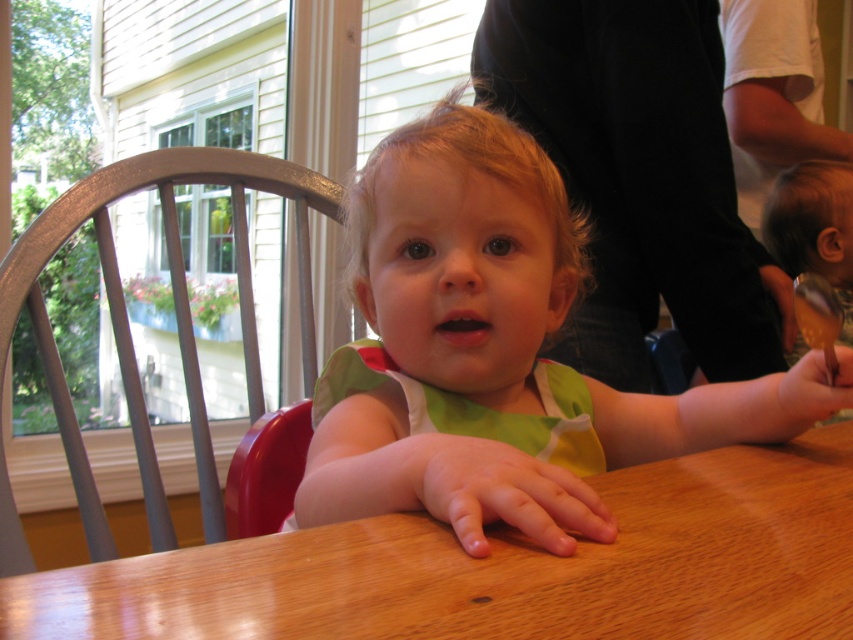
You are a parent trying to decide whether to place a spoon in the child reach area. The green cotton bib at center is on the table. Where should you place the smooth wooden spoon at lower right so it is within the child reach but not too close to the bib?

The smooth wooden spoon at lower right should be placed further away from the green cotton bib at center since the bib is closer to the viewer. Position the spoon slightly behind the bib but still within the child reach area to ensure safety and accessibility.

You are a photographer setting up for a portrait. You need to position your camera so that the wooden table at center is exactly 30 centimeters away from the lens. Based on the scene description, is the current camera position correct?

The wooden table at center is 30.60 centimeters from the camera, which is slightly more than 30 centimeters. Therefore, the current camera position is not correct. You need to move the camera about 0.6 centimeters closer to the wooden table at center to achieve the desired distance.